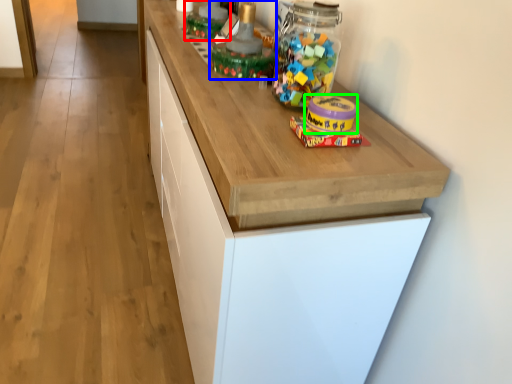
Question: Estimate the real-world distances between objects in this image. Which object is farther from toy (highlighted by a red box), toy (highlighted by a blue box) or toy (highlighted by a green box)?

Choices:
 (A) toy
 (B) toy

Answer: (B)